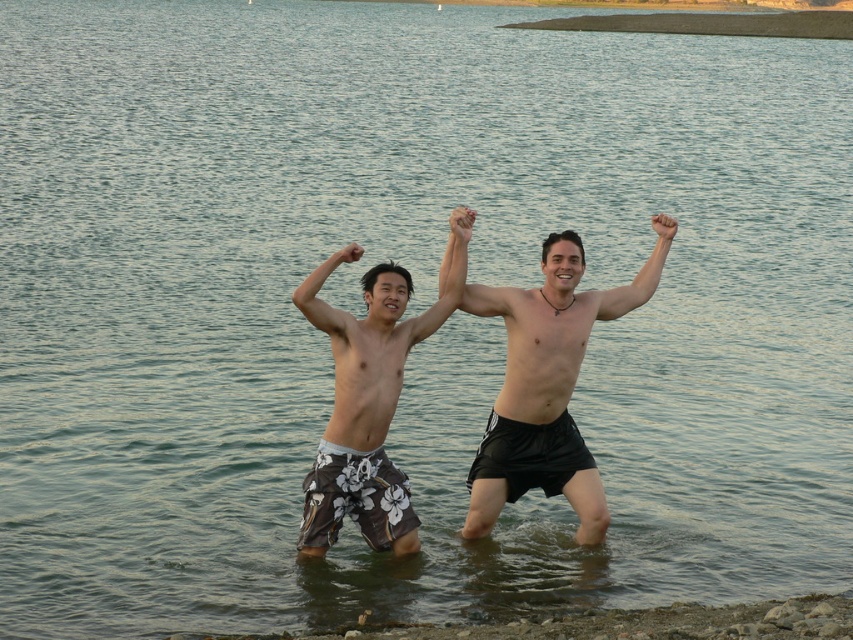
You are a photographer trying to capture the two points in the scene. Which point is closer to the camera, point 1 at coordinates [352,412] or point 2 at coordinates [316,305]?

Point 2 at coordinates [316,305] is closer to the camera because it is less further to the viewer than point 1 at coordinates [352,412].

Consider the image. You are a photographer trying to capture the perfect shot of the two people in the water. You notice a specific point at coordinates [370,392] in the image. Based on the scene, where exactly is this point located?

The point at coordinates [370,392] is located on the floral patterned shorts at center.